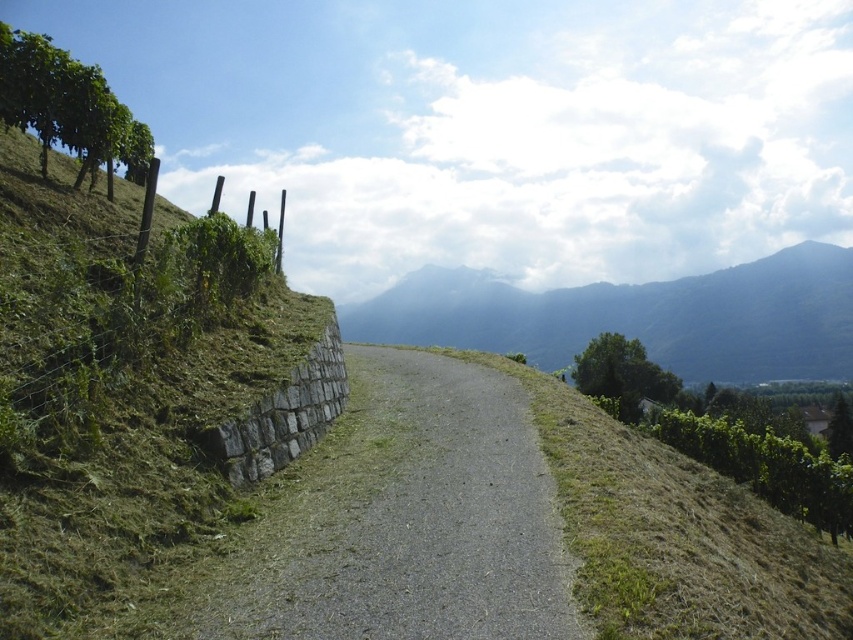
Question: Can you confirm if gray gravel path at center is positioned to the left of grayish-blue mountain range at center?

Choices:
 (A) no
 (B) yes

Answer: (B)

Question: Which object appears farthest from the camera in this image?

Choices:
 (A) gray gravel path at center
 (B) grayish-blue mountain range at center

Answer: (B)

Question: Is gray gravel path at center below grayish-blue mountain range at center?

Choices:
 (A) yes
 (B) no

Answer: (A)

Question: Which object is closer to the camera taking this photo?

Choices:
 (A) grayish-blue mountain range at center
 (B) gray gravel path at center

Answer: (B)

Question: Can you confirm if gray gravel path at center is wider than grayish-blue mountain range at center?

Choices:
 (A) no
 (B) yes

Answer: (A)